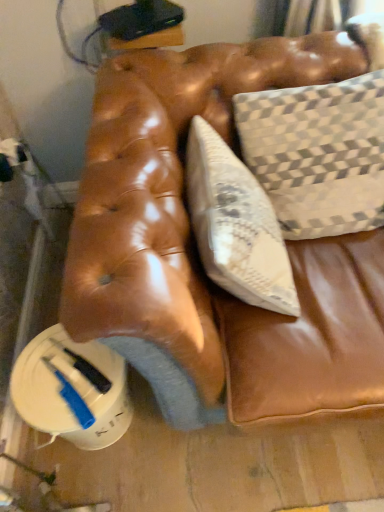
Question: From the image's perspective, is textured beige pillow at upper right over leather couch cushion at center?

Choices:
 (A) no
 (B) yes

Answer: (B)

Question: From a real-world perspective, is textured beige pillow at upper right located higher than leather couch cushion at center?

Choices:
 (A) no
 (B) yes

Answer: (B)

Question: Does textured beige pillow at upper right have a lesser height compared to leather couch cushion at center?

Choices:
 (A) yes
 (B) no

Answer: (B)

Question: Is leather couch cushion at center surrounded by textured beige pillow at upper right?

Choices:
 (A) no
 (B) yes

Answer: (A)

Question: Can you confirm if textured beige pillow at upper right is smaller than leather couch cushion at center?

Choices:
 (A) no
 (B) yes

Answer: (B)

Question: From a real-world perspective, is textured beige pillow at upper right below leather couch cushion at center?

Choices:
 (A) no
 (B) yes

Answer: (A)

Question: Considering the relative sizes of leather couch cushion at center and textured beige pillow at upper right in the image provided, is leather couch cushion at center taller than textured beige pillow at upper right?

Choices:
 (A) yes
 (B) no

Answer: (B)

Question: Does leather couch cushion at center have a smaller size compared to textured beige pillow at upper right?

Choices:
 (A) yes
 (B) no

Answer: (B)

Question: From a real-world perspective, does leather couch cushion at center stand above textured beige pillow at upper right?

Choices:
 (A) yes
 (B) no

Answer: (B)

Question: Would you say textured beige pillow at upper right is part of leather couch cushion at center's contents?

Choices:
 (A) yes
 (B) no

Answer: (B)

Question: Can you confirm if leather couch cushion at center is bigger than textured beige pillow at upper right?

Choices:
 (A) no
 (B) yes

Answer: (B)

Question: Considering the relative positions of leather couch cushion at center and textured beige pillow at upper right in the image provided, is leather couch cushion at center to the right of textured beige pillow at upper right from the viewer's perspective?

Choices:
 (A) no
 (B) yes

Answer: (A)

Question: Is textured beige pillow at upper right spatially inside leather couch cushion at center, or outside of it?

Choices:
 (A) outside
 (B) inside

Answer: (A)